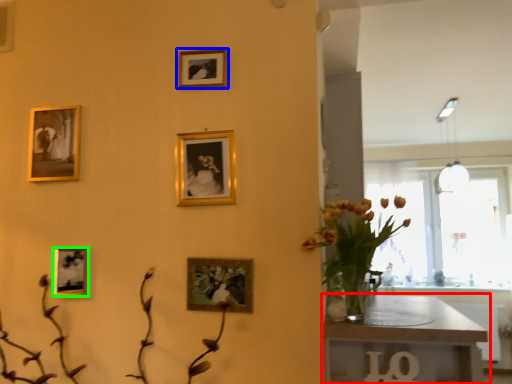
Question: Which object is the farthest from table (highlighted by a red box)? Choose among these: picture frame (highlighted by a blue box) or picture frame (highlighted by a green box).

Choices:
 (A) picture frame
 (B) picture frame

Answer: (B)